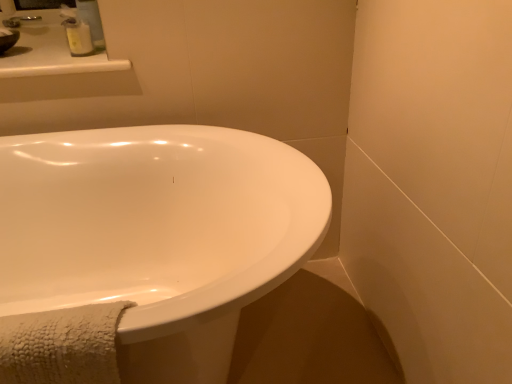
You are a GUI agent. You are given a task and a screenshot of the screen. Output one action in this format:
    pyautogui.click(x=<x>, y=<y>)
    Task: Click on the vacant area that lies in front of white plastic soap dispenser at upper left
    This screenshot has width=512, height=384.
    Given the screenshot: What is the action you would take?
    pyautogui.click(x=64, y=67)